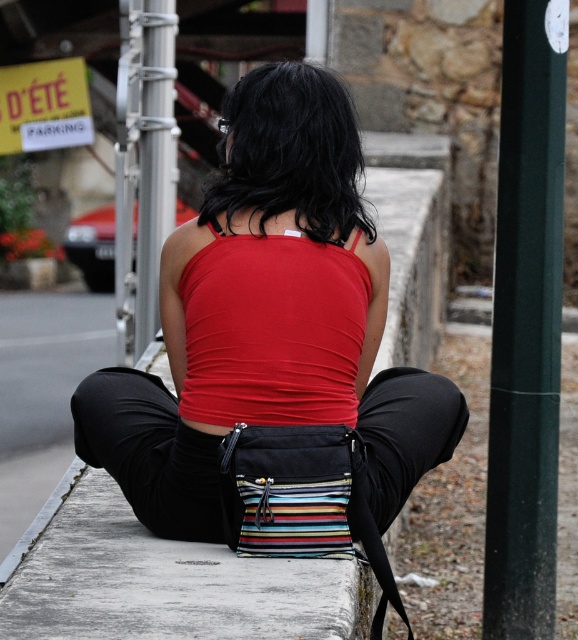
Question: Considering the relative positions of green matte pole at right and red matte tank top at center in the image provided, where is green matte pole at right located with respect to red matte tank top at center?

Choices:
 (A) above
 (B) below

Answer: (A)

Question: Which point is farther to the camera?

Choices:
 (A) red matte tank top at center
 (B) green matte pole at right
 (C) matte black tank top at center

Answer: (B)

Question: Which point appears closest to the camera in this image?

Choices:
 (A) (302, 381)
 (B) (135, 476)

Answer: (A)

Question: Does green matte pole at right lie behind red matte tank top at center?

Choices:
 (A) no
 (B) yes

Answer: (B)

Question: Which object is farther from the camera taking this photo?

Choices:
 (A) green matte pole at right
 (B) red matte tank top at center
 (C) matte black tank top at center

Answer: (A)

Question: Can you confirm if matte black tank top at center is wider than red matte tank top at center?

Choices:
 (A) yes
 (B) no

Answer: (A)